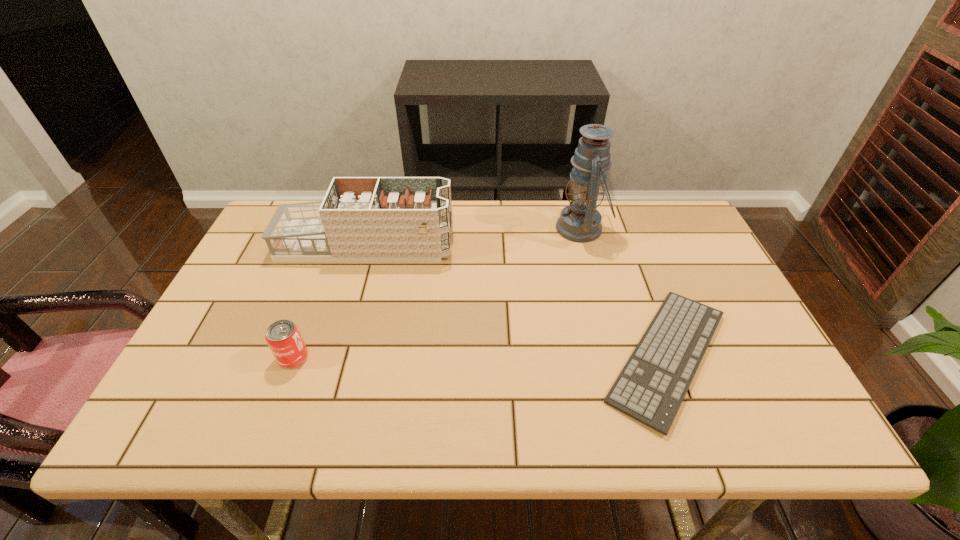
Find the location of a particular element. The image size is (960, 540). lantern that is at the far edge is located at coordinates (580, 222).

I want to click on dollhouse at the far edge, so 360,218.

You are a GUI agent. You are given a task and a screenshot of the screen. Output one action in this format:
    pyautogui.click(x=<x>, y=<y>)
    Task: Click on the object situated at the near edge
    
    Given the screenshot: What is the action you would take?
    pyautogui.click(x=651, y=387)

Locate an element on the screen. This screenshot has width=960, height=540. object present at the left edge is located at coordinates (360, 218).

At what (x,y) coordinates should I click in order to perform the action: click on object that is at the right edge. Please return your answer as a coordinate pair (x, y). The height and width of the screenshot is (540, 960). Looking at the image, I should click on (651, 387).

Locate an element on the screen. object that is at the far left corner is located at coordinates point(360,218).

Image resolution: width=960 pixels, height=540 pixels. Find the location of `object that is at the near right corner`. object that is at the near right corner is located at coordinates (651, 387).

The width and height of the screenshot is (960, 540). I want to click on vacant space at the far edge, so click(505, 202).

Where is `vacant region at the near edge`? The height and width of the screenshot is (540, 960). vacant region at the near edge is located at coordinates (705, 441).

Locate an element on the screen. vacant region at the left edge of the desktop is located at coordinates (168, 394).